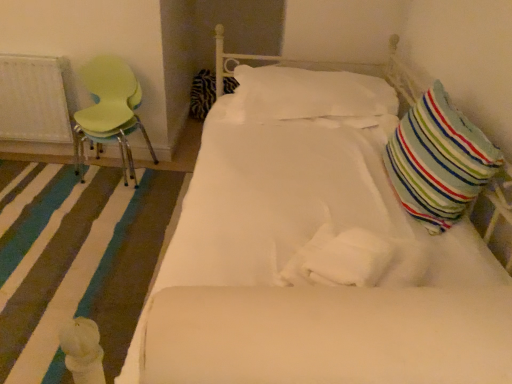
Question: From their relative heights in the image, would you say striped fabric pillow at right, the 1th pillow from the front, is taller or shorter than white textured radiator at left?

Choices:
 (A) tall
 (B) short

Answer: (B)

Question: Considering the relative positions of striped fabric pillow at right, placed as the 1th pillow when sorted from right to left, and white textured radiator at left in the image provided, is striped fabric pillow at right, placed as the 1th pillow when sorted from right to left, to the left or to the right of white textured radiator at left?

Choices:
 (A) left
 (B) right

Answer: (B)

Question: Considering the real-world distances, which object is farthest from the white soft pillow at center, which is the 2th pillow in back-to-front order?

Choices:
 (A) zebra-patterned fabric pillow at center-left, placed as the 3th pillow when sorted from right to left
 (B) striped fabric pillow at right, the 3th pillow when ordered from left to right
 (C) white textured radiator at left
 (D) white fabric rug at lower left
 (E) light green plastic chair at left

Answer: (A)

Question: Which object is the closest to the white fabric rug at lower left?

Choices:
 (A) light green plastic chair at left
 (B) white soft pillow at center, which appears as the 2th pillow when viewed from the front
 (C) striped fabric pillow at right, placed as the 1th pillow when sorted from right to left
 (D) white textured radiator at left
 (E) zebra-patterned fabric pillow at center-left, which ranks as the first pillow in back-to-front order

Answer: (A)